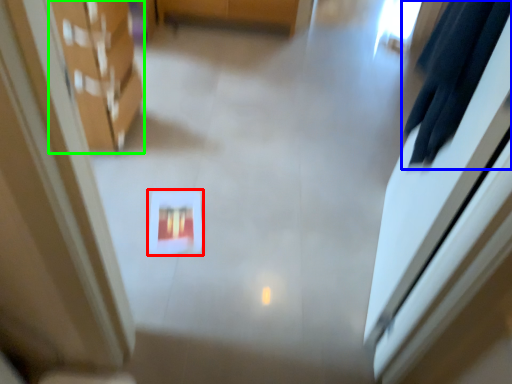
Question: Estimate the real-world distances between objects in this image. Which object is farther from square (highlighted by a red box), robe (highlighted by a blue box) or furniture (highlighted by a green box)?

Choices:
 (A) robe
 (B) furniture

Answer: (A)